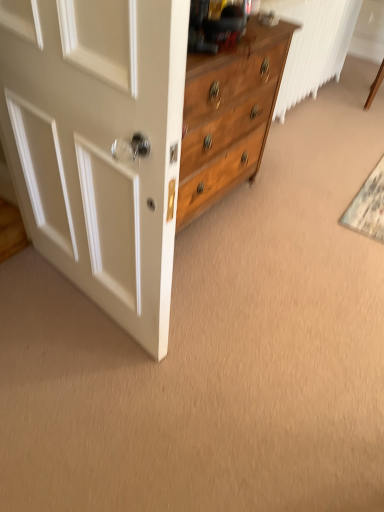
Question: Could you tell me if textured gray doormat at lower right is facing white glossy door at left?

Choices:
 (A) yes
 (B) no

Answer: (B)

Question: Does textured gray doormat at lower right come in front of white glossy door at left?

Choices:
 (A) no
 (B) yes

Answer: (A)

Question: Is textured gray doormat at lower right to the right of white glossy door at left from the viewer's perspective?

Choices:
 (A) no
 (B) yes

Answer: (B)

Question: Does textured gray doormat at lower right have a larger size compared to white glossy door at left?

Choices:
 (A) no
 (B) yes

Answer: (A)

Question: Is the depth of textured gray doormat at lower right greater than that of white glossy door at left?

Choices:
 (A) no
 (B) yes

Answer: (B)

Question: From a real-world perspective, is textured gray doormat at lower right located beneath white glossy door at left?

Choices:
 (A) yes
 (B) no

Answer: (A)

Question: Is white glossy door at left to the right of textured gray doormat at lower right from the viewer's perspective?

Choices:
 (A) yes
 (B) no

Answer: (B)

Question: Is white glossy door at left taller than textured gray doormat at lower right?

Choices:
 (A) no
 (B) yes

Answer: (B)

Question: Are white glossy door at left and textured gray doormat at lower right located far from each other?

Choices:
 (A) yes
 (B) no

Answer: (A)

Question: From the image's perspective, is white glossy door at left located beneath textured gray doormat at lower right?

Choices:
 (A) no
 (B) yes

Answer: (B)

Question: Considering the relative positions of white glossy door at left and textured gray doormat at lower right in the image provided, is white glossy door at left to the left of textured gray doormat at lower right from the viewer's perspective?

Choices:
 (A) no
 (B) yes

Answer: (B)

Question: Can you confirm if white glossy door at left is smaller than textured gray doormat at lower right?

Choices:
 (A) yes
 (B) no

Answer: (B)

Question: Considering the positions of point (117, 173) and point (367, 214), is point (117, 173) closer or farther from the camera than point (367, 214)?

Choices:
 (A) farther
 (B) closer

Answer: (B)